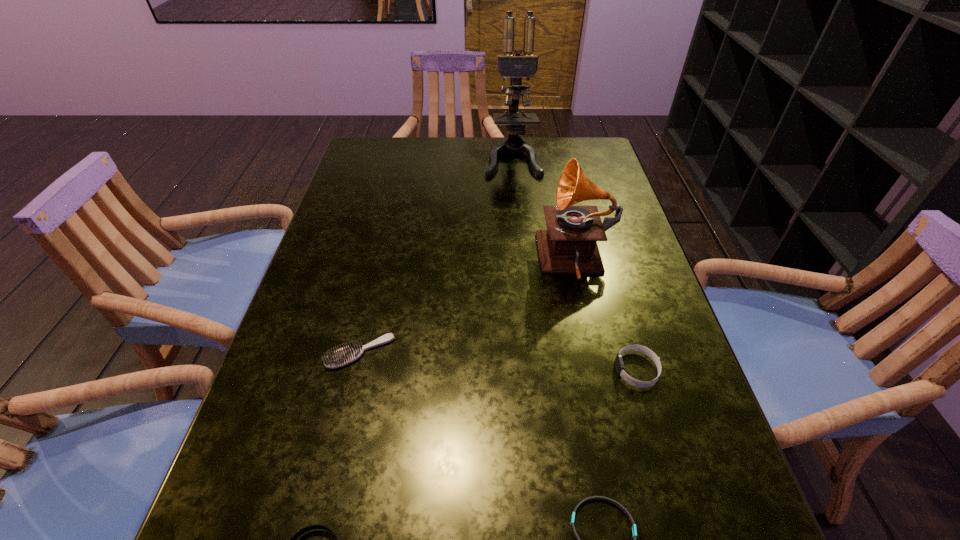
Image resolution: width=960 pixels, height=540 pixels. What are the coordinates of `microscope` in the screenshot? It's located at (516, 66).

This screenshot has width=960, height=540. Identify the location of the farthest object. (516, 66).

The height and width of the screenshot is (540, 960). Find the location of `the second tallest object`. the second tallest object is located at coordinates (569, 245).

The image size is (960, 540). What are the coordinates of `phonograph record` in the screenshot? It's located at (569, 245).

Where is `the tallest wristband`? The image size is (960, 540). the tallest wristband is located at coordinates (619, 364).

This screenshot has width=960, height=540. I want to click on the farthest wristband, so click(x=619, y=364).

Where is `scrubbing brush`? The width and height of the screenshot is (960, 540). scrubbing brush is located at coordinates (343, 356).

The image size is (960, 540). What are the coordinates of `vacant area situated 0.300m at the eyepieces of the microscope` in the screenshot? It's located at (521, 245).

This screenshot has width=960, height=540. I want to click on vacant space located on the horn of the phonograph record, so [x=468, y=261].

Locate an element on the screen. free spot located 0.110m on the horn of the phonograph record is located at coordinates (492, 261).